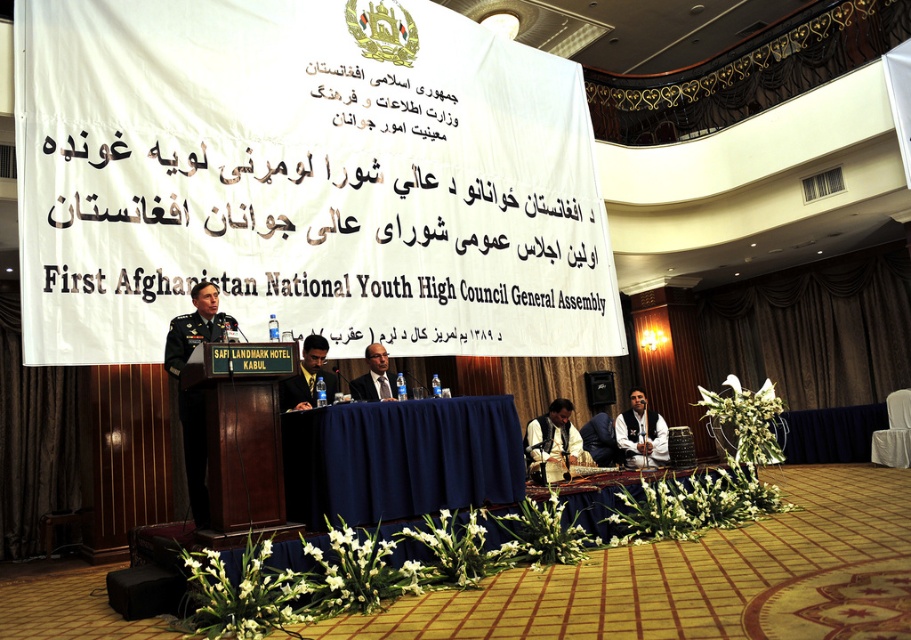
This screenshot has height=640, width=911. What do you see at coordinates (400, 458) in the screenshot?
I see `blue fabric table at center` at bounding box center [400, 458].

From the picture: Is blue fabric table at center to the left of matte black suit at center from the viewer's perspective?

In fact, blue fabric table at center is to the right of matte black suit at center.

I want to click on blue fabric table at center, so click(400, 458).

The width and height of the screenshot is (911, 640). I want to click on blue fabric table at center, so click(400, 458).

How much distance is there between dark green military uniform at center and dark green fabric uniform at center?

dark green military uniform at center is 3.39 meters from dark green fabric uniform at center.

Between dark green military uniform at center and dark green fabric uniform at center, which one appears on the right side from the viewer's perspective?

From the viewer's perspective, dark green fabric uniform at center appears more on the right side.

Is point (324, 342) in front of point (591, 438)?

That is True.

Locate an element on the screen. dark green military uniform at center is located at coordinates (306, 376).

Can you confirm if blue fabric table at center is wider than dark green fabric uniform at center?

Correct, the width of blue fabric table at center exceeds that of dark green fabric uniform at center.

Who is more forward, (x=351, y=420) or (x=585, y=436)?

Point (x=351, y=420) is in front.

Who is more distant from viewer, [519,483] or [595,458]?

Point [595,458]

Locate an element on the screen. Image resolution: width=911 pixels, height=640 pixels. blue fabric table at center is located at coordinates (400, 458).